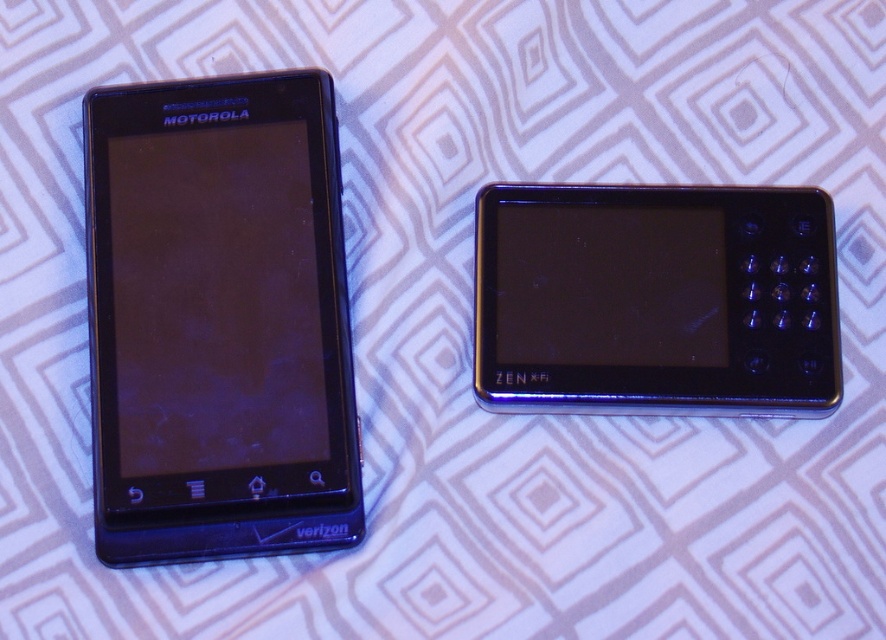
Question: Which point is closer to the camera?

Choices:
 (A) (584, 310)
 (B) (148, 515)

Answer: (B)

Question: Can you confirm if black glossy smartphone at left is thinner than black plastic zen phone at right?

Choices:
 (A) no
 (B) yes

Answer: (B)

Question: Does black glossy smartphone at left have a greater width compared to black plastic zen phone at right?

Choices:
 (A) yes
 (B) no

Answer: (B)

Question: Can you confirm if black glossy smartphone at left is positioned below black plastic zen phone at right?

Choices:
 (A) yes
 (B) no

Answer: (A)